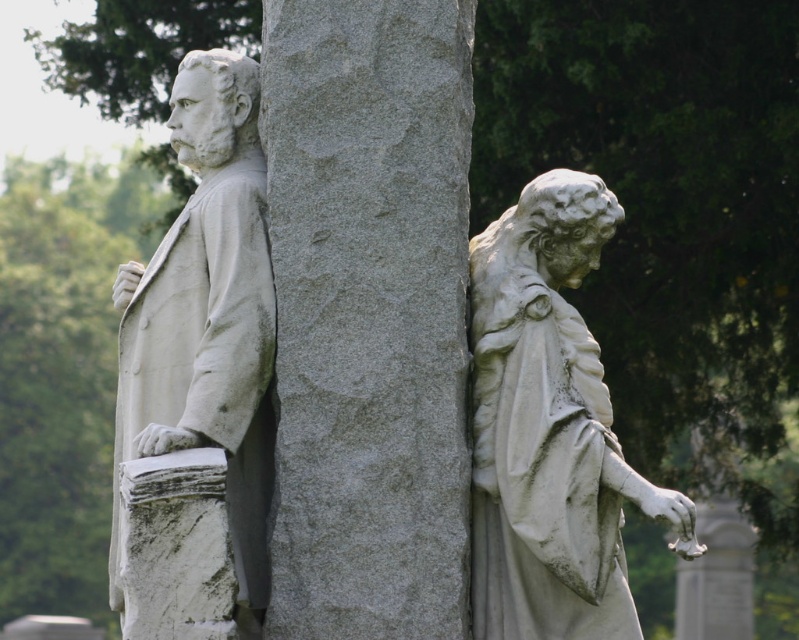
In the scene shown: You are an architect designing a new garden layout. You need to place a 2.5 meter tall decorative fountain in such a way that it doesn not block the view of the white marble statue at right from the main pathway. Given the gray stone column at center is already present, where should you position the fountain?

The gray stone column at center is taller than the white marble statue at right. To avoid blocking the view of the white marble statue at right, position the fountain behind the gray stone column at center so that it remains shorter than the column and does not obstruct the statue from the main pathway.

You are standing in front of the two statues and want to take a photo that includes both. Which point, point (509, 573) or point (122, 324), is closer to you?

Point (509, 573) is closer to you than point (122, 324).

You are a tourist standing in front of the statues and want to take a photo of the white marble statue at left without the gray stone column at center blocking the view. Is this possible?

The white marble statue at left is behind the gray stone column at center, so it would be blocked by the column. To take a photo of the white marble statue at left without the gray stone column at center blocking the view, you would need to move to a position where the column is not between you and the statue.